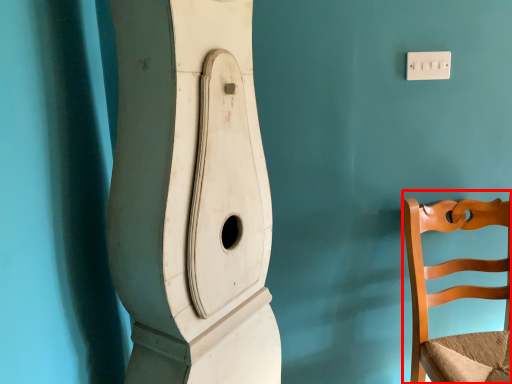
Question: From the image, what is the correct spatial relationship of chair (annotated by the red box) in relation to light switch?

Choices:
 (A) left
 (B) right

Answer: (B)